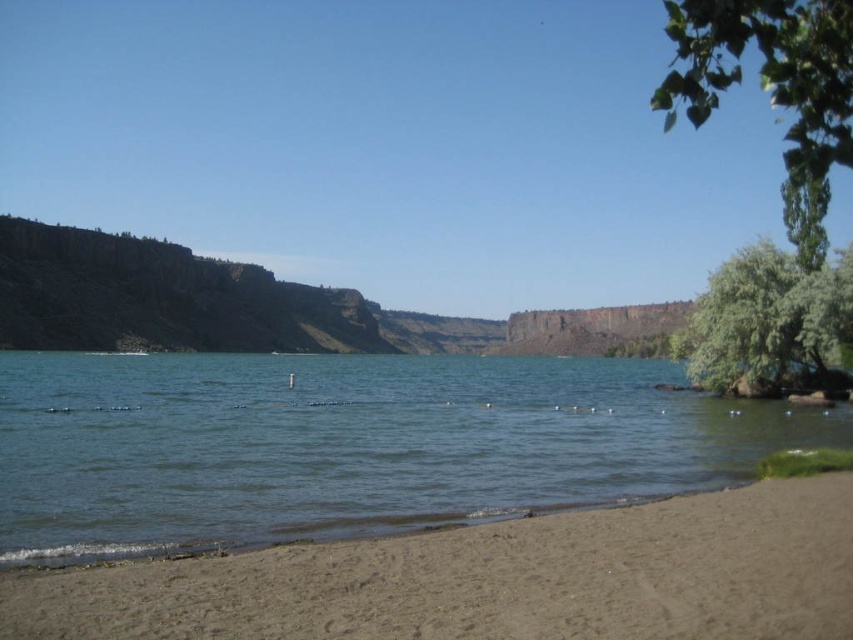
Question: Which point appears closest to the camera in this image?

Choices:
 (A) (776, 321)
 (B) (38, 352)
 (C) (376, 554)

Answer: (C)

Question: Which point is farther from the camera taking this photo?

Choices:
 (A) tap(809, 65)
 (B) tap(718, 604)
 (C) tap(288, 420)

Answer: (C)

Question: Does clear water at lower center appear on the right side of green leafy tree at upper right?

Choices:
 (A) yes
 (B) no

Answer: (B)

Question: Which point is closer to the camera?

Choices:
 (A) green leafy tree at right
 (B) green leafy tree at upper right
 (C) brown sandy beach at lower left
 (D) clear water at lower center

Answer: (B)

Question: In this image, where is brown sandy beach at lower left located relative to green leafy tree at upper right?

Choices:
 (A) above
 (B) below

Answer: (B)

Question: Considering the relative positions of clear water at lower center and brown sandy beach at lower left in the image provided, where is clear water at lower center located with respect to brown sandy beach at lower left?

Choices:
 (A) below
 (B) above

Answer: (B)